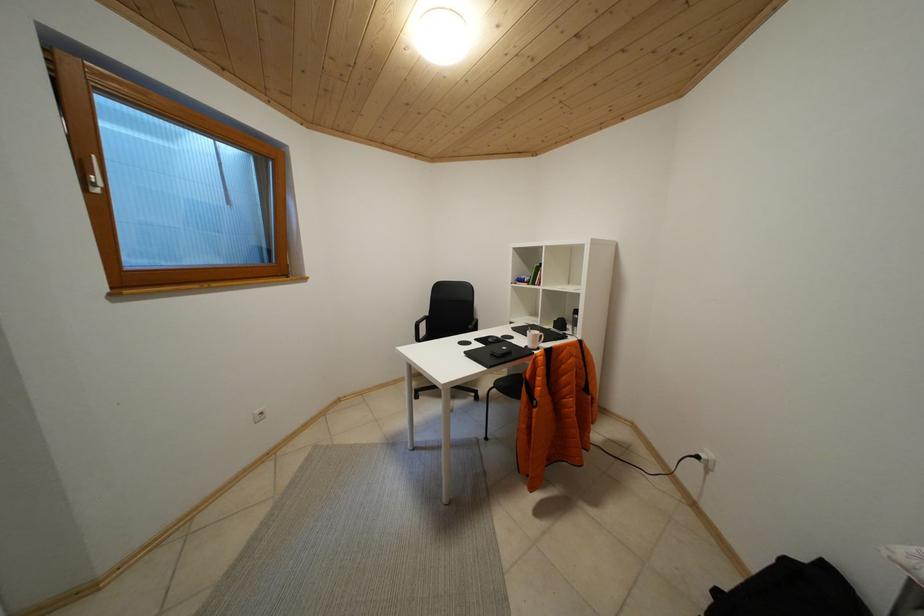
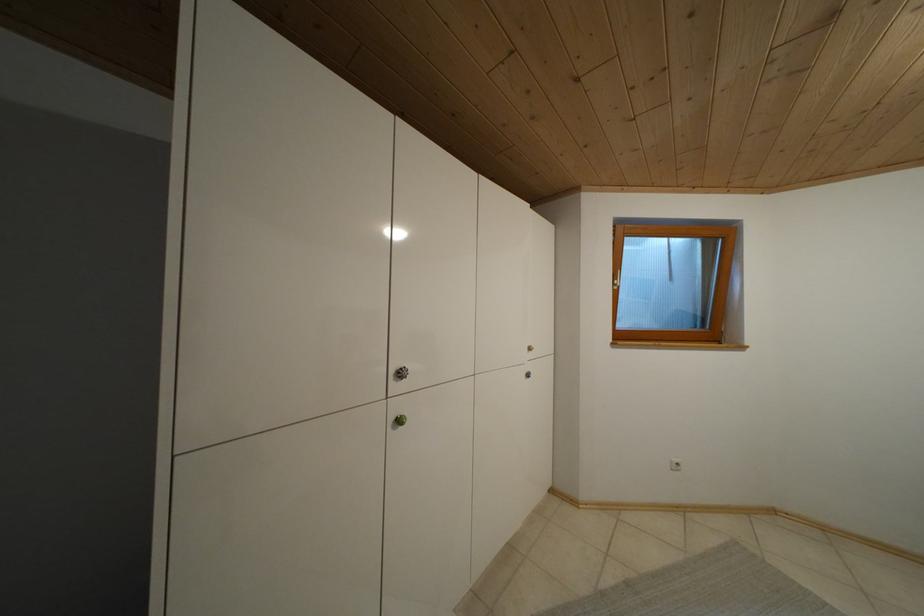
Question: The images are taken continuously from a first-person perspective. In which direction is your viewpoint rotating?

Choices:
 (A) Left
 (B) Right
 (C) Up
 (D) Down

Answer: (A)